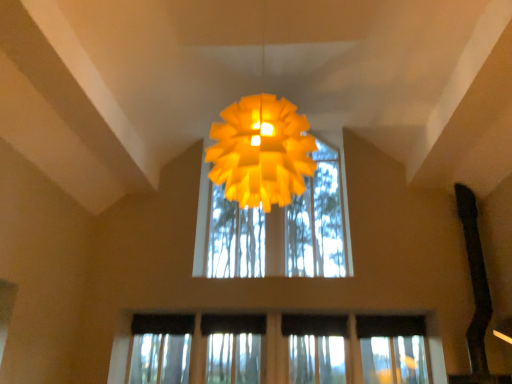
What do you see at coordinates (261, 152) in the screenshot? The height and width of the screenshot is (384, 512). I see `matte yellow paper lamp at center` at bounding box center [261, 152].

Locate an element on the screen. matte yellow paper lamp at center is located at coordinates (261, 152).

Measure the distance between transparent glass window at center and camera.

transparent glass window at center is 17.56 feet away from camera.

I want to click on transparent glass window at center, so click(x=121, y=349).

Describe the element at coordinates (121, 349) in the screenshot. I see `transparent glass window at center` at that location.

Identify the location of matte yellow paper lamp at center. (261, 152).

Which is more to the left, matte yellow paper lamp at center or transparent glass window at center?

Positioned to the left is matte yellow paper lamp at center.

Is the depth of matte yellow paper lamp at center less than that of transparent glass window at center?

Yes, matte yellow paper lamp at center is closer to the camera.

In the scene shown: Which point is more distant from viewer, (214, 172) or (199, 330)?

The point (199, 330) is more distant.

From the image's perspective, relative to transparent glass window at center, is matte yellow paper lamp at center above or below?

matte yellow paper lamp at center is situated higher than transparent glass window at center in the image.

From a real-world perspective, is matte yellow paper lamp at center physically located above or below transparent glass window at center?

Clearly, from a real-world perspective, matte yellow paper lamp at center is above transparent glass window at center.

Which of these two, matte yellow paper lamp at center or transparent glass window at center, is thinner?

With smaller width is transparent glass window at center.

Which of these two, matte yellow paper lamp at center or transparent glass window at center, stands taller?

Standing taller between the two is matte yellow paper lamp at center.

Is matte yellow paper lamp at center bigger than transparent glass window at center?

Correct, matte yellow paper lamp at center is larger in size than transparent glass window at center.

Is matte yellow paper lamp at center spatially inside transparent glass window at center, or outside of it?

matte yellow paper lamp at center exists outside the volume of transparent glass window at center.

Is matte yellow paper lamp at center far away from transparent glass window at center?

Yes, matte yellow paper lamp at center is far from transparent glass window at center.

Is matte yellow paper lamp at center facing towards transparent glass window at center?

No, matte yellow paper lamp at center does not turn towards transparent glass window at center.

What's the angular difference between matte yellow paper lamp at center and transparent glass window at center's facing directions?

There is a 1.85-degree angle between the facing directions of matte yellow paper lamp at center and transparent glass window at center.

Locate an element on the screen. The height and width of the screenshot is (384, 512). window directly beneath the matte yellow paper lamp at center (from a real-world perspective) is located at coordinates coord(121,349).

Can you confirm if transparent glass window at center is positioned to the right of matte yellow paper lamp at center?

Yes, transparent glass window at center is to the right of matte yellow paper lamp at center.

From the picture: Is transparent glass window at center positioned behind matte yellow paper lamp at center?

Yes, transparent glass window at center is behind matte yellow paper lamp at center.

Is point (436, 315) positioned after point (234, 175)?

Yes, it is behind point (234, 175).

From the image's perspective, does transparent glass window at center appear lower than matte yellow paper lamp at center?

Correct, transparent glass window at center appears lower than matte yellow paper lamp at center in the image.

From a real-world perspective, is transparent glass window at center on top of matte yellow paper lamp at center?

No, from a real-world perspective, transparent glass window at center is not above matte yellow paper lamp at center.

Based on the photo, in terms of width, does transparent glass window at center look wider or thinner when compared to matte yellow paper lamp at center?

In the image, transparent glass window at center appears to be more narrow than matte yellow paper lamp at center.

Consider the image. Who is shorter, transparent glass window at center or matte yellow paper lamp at center?

Standing shorter between the two is transparent glass window at center.

Considering the sizes of transparent glass window at center and matte yellow paper lamp at center in the image, is transparent glass window at center bigger or smaller than matte yellow paper lamp at center?

transparent glass window at center is smaller than matte yellow paper lamp at center.

Would you say transparent glass window at center is inside or outside matte yellow paper lamp at center?

transparent glass window at center is not enclosed by matte yellow paper lamp at center.

In the scene shown: Is transparent glass window at center touching matte yellow paper lamp at center?

They are not placed beside each other.

Is transparent glass window at center oriented towards matte yellow paper lamp at center?

No, transparent glass window at center is not aimed at matte yellow paper lamp at center.

What's the angular difference between transparent glass window at center and matte yellow paper lamp at center's facing directions?

1.85 degrees separate the facing orientations of transparent glass window at center and matte yellow paper lamp at center.

Find the location of `lamp to the left of transparent glass window at center`. lamp to the left of transparent glass window at center is located at coordinates (261, 152).

I want to click on window below the matte yellow paper lamp at center (from a real-world perspective), so click(121, 349).

At what (x,y) coordinates should I click in order to perform the action: click on lamp located above the transparent glass window at center (from a real-world perspective). Please return your answer as a coordinate pair (x, y). Looking at the image, I should click on (261, 152).